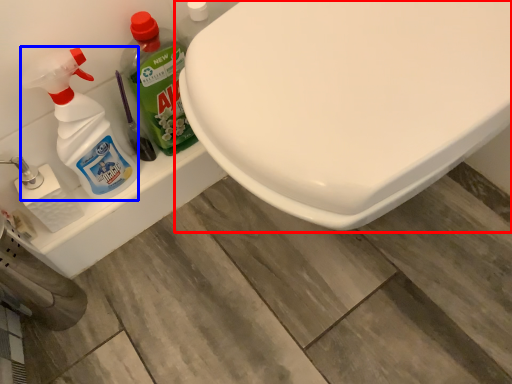
Question: Which object is further to the camera taking this photo, toilet (highlighted by a red box) or cleaning product (highlighted by a blue box)?

Choices:
 (A) toilet
 (B) cleaning product

Answer: (B)